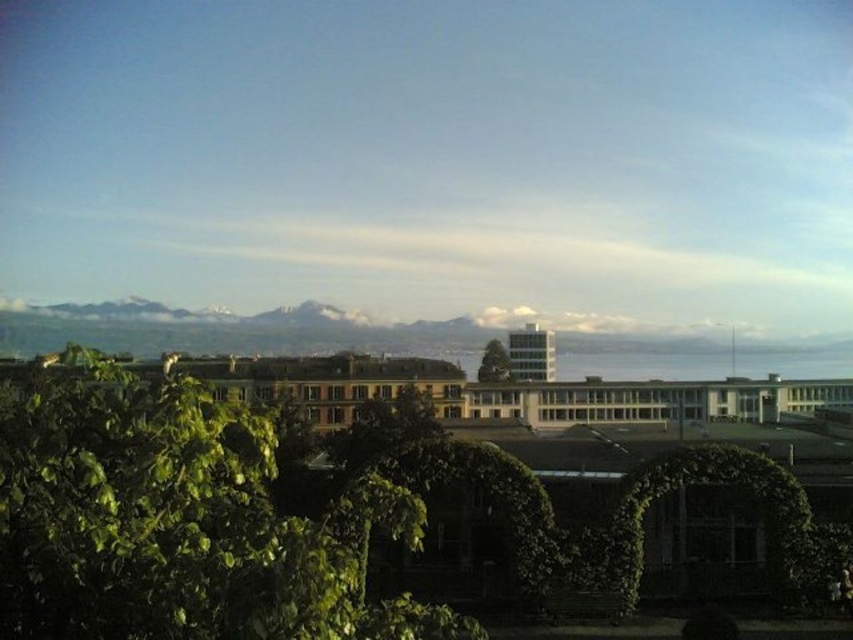
Measure the distance between point (245, 564) and camera.

20.83 meters

The image size is (853, 640). What do you see at coordinates (178, 522) in the screenshot? I see `green leafy tree at lower left` at bounding box center [178, 522].

Does point (183, 403) come closer to viewer compared to point (502, 353)?

Yes, point (183, 403) is in front of point (502, 353).

Where is `green leafy tree at lower left`? green leafy tree at lower left is located at coordinates (178, 522).